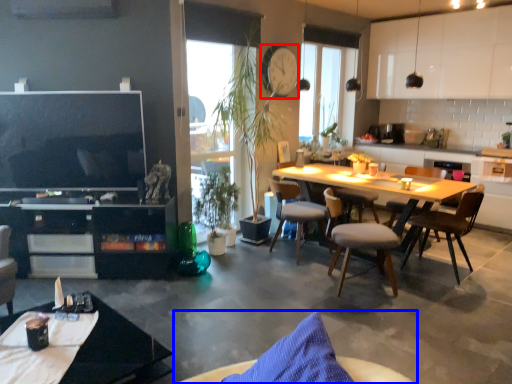
Question: Which point is closer to the camera, clock (highlighted by a red box) or chair (highlighted by a blue box)?

Choices:
 (A) clock
 (B) chair

Answer: (B)